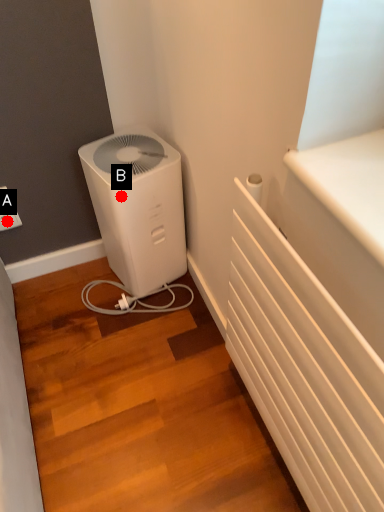
Question: Two points are circled on the image, labeled by A and B beside each circle. Which of the following is the farthest from the observer?

Choices:
 (A) A is further
 (B) B is further

Answer: (A)